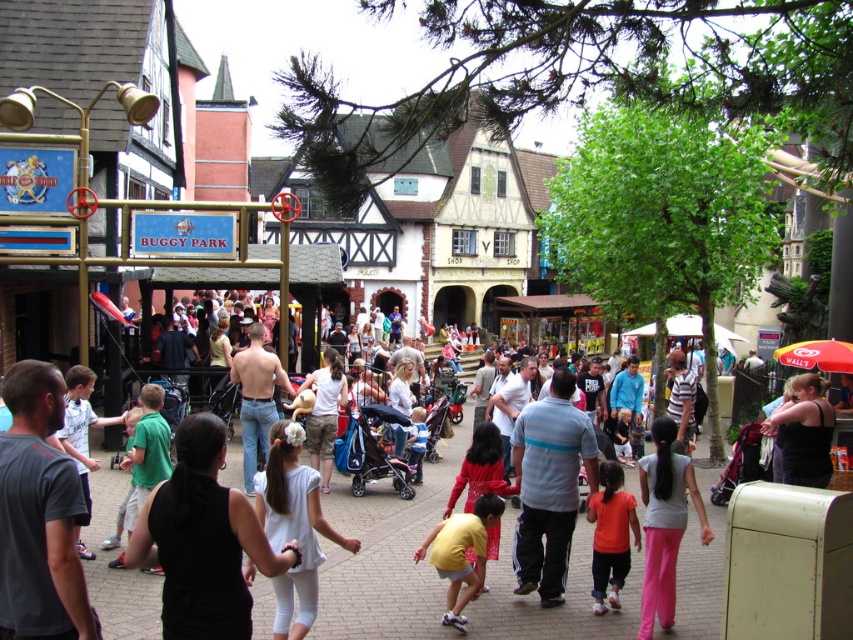
Question: Can you confirm if yellow matte shirt at center is positioned to the right of orange cotton shirt at center?

Choices:
 (A) no
 (B) yes

Answer: (A)

Question: Is yellow matte shirt at center behind orange cotton shirt at center?

Choices:
 (A) no
 (B) yes

Answer: (A)

Question: Can you confirm if yellow matte shirt at center is positioned above orange cotton shirt at center?

Choices:
 (A) no
 (B) yes

Answer: (A)